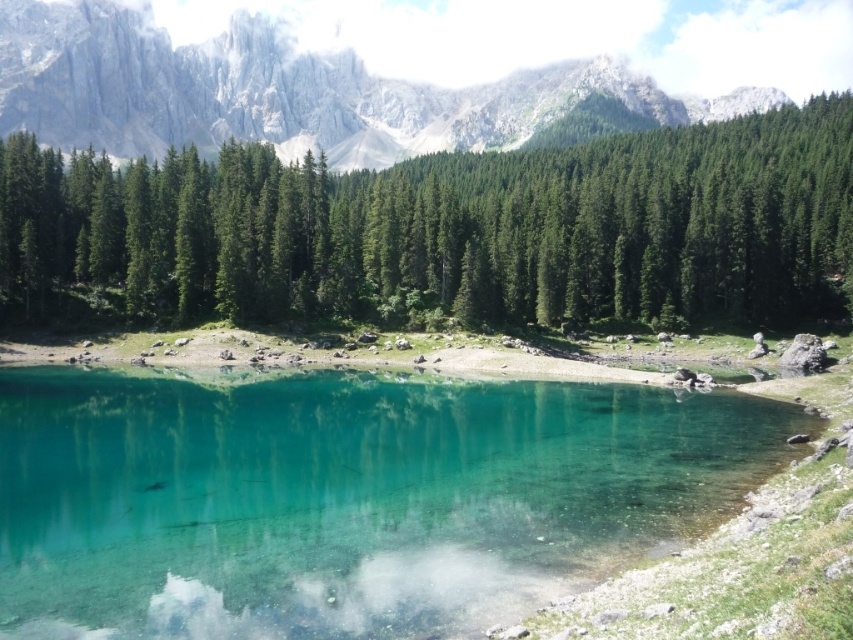
Between green matte tree at center and rugged stone mountain at upper center, which one is positioned higher?

rugged stone mountain at upper center

Which is more to the right, green matte tree at center or rugged stone mountain at upper center?

Positioned to the right is green matte tree at center.

Image resolution: width=853 pixels, height=640 pixels. Describe the element at coordinates (445, 228) in the screenshot. I see `green matte tree at center` at that location.

Where is `green matte tree at center`? Image resolution: width=853 pixels, height=640 pixels. green matte tree at center is located at coordinates (445, 228).

Who is more distant from viewer, (x=641, y=410) or (x=258, y=64)?

Positioned behind is point (x=258, y=64).

Who is more forward, (717, 492) or (431, 88)?

Point (717, 492)

Find the location of a particular element. This screenshot has width=853, height=640. clear glass water at center is located at coordinates point(346,497).

Can you confirm if clear glass water at center is positioned below green matte tree at center?

Indeed, clear glass water at center is positioned under green matte tree at center.

Locate an element on the screen. clear glass water at center is located at coordinates (346, 497).